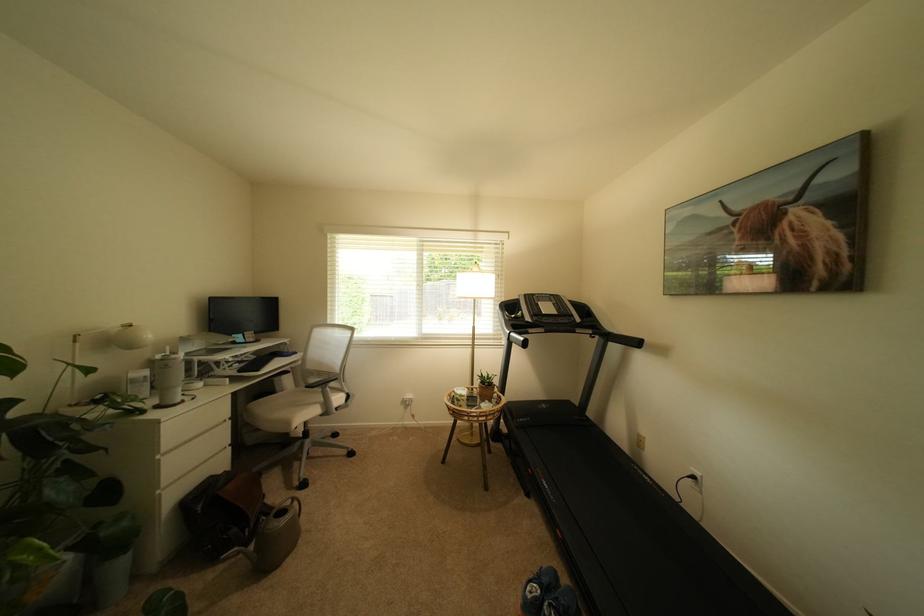
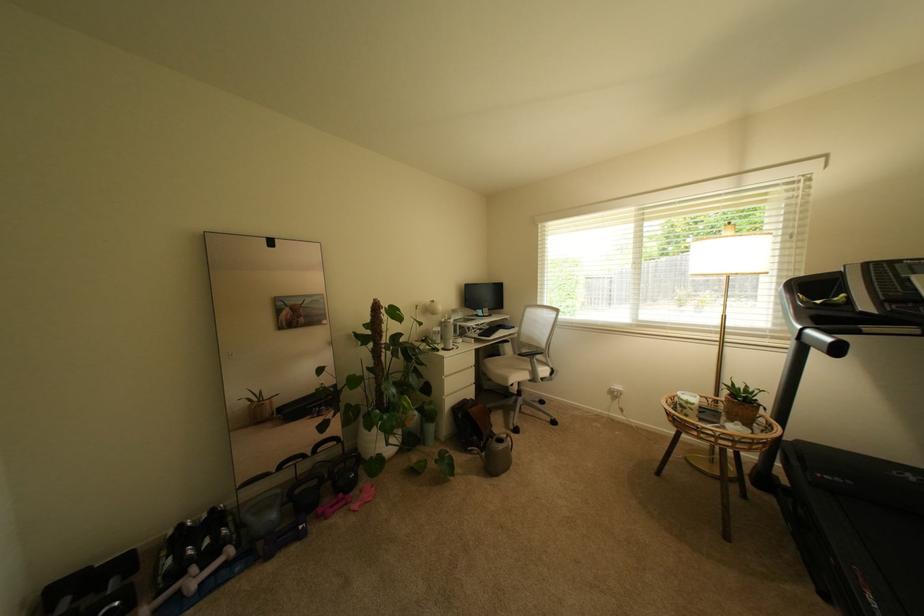
The point at (165,403) is marked in the first image. Where is the corresponding point in the second image?

(451, 347)